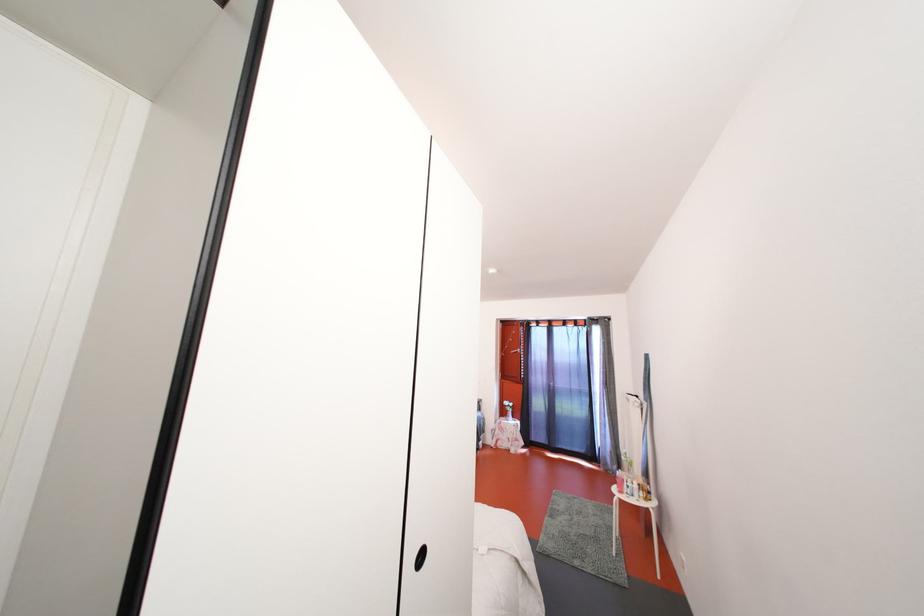
In order to click on black recessed handle in this screenshot , I will do `click(419, 557)`.